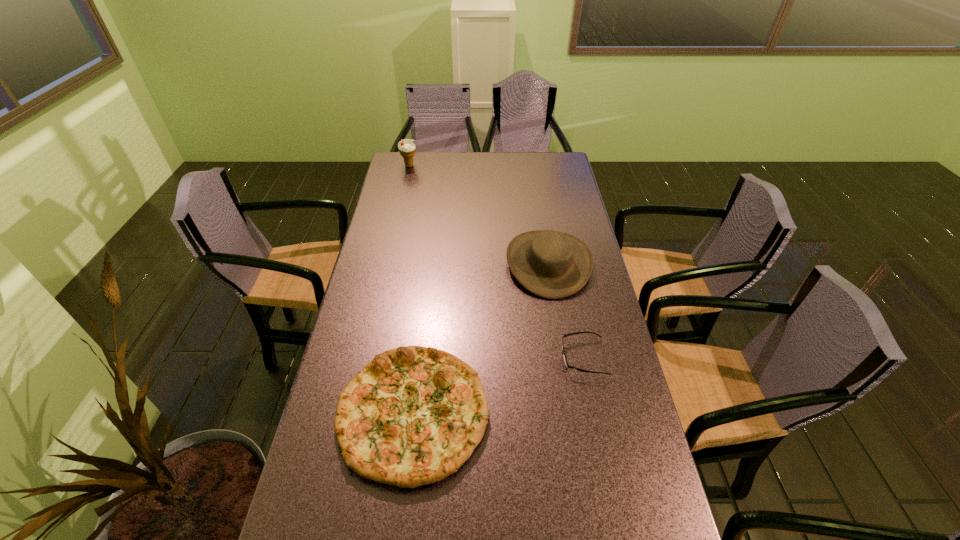
Identify the location of vacant space at the right edge. point(583,339).

In the image, there is a desktop. In order to click on vacant space at the far left corner in this screenshot , I will do `click(418, 173)`.

Identify the location of vacant space at the far right corner of the desktop. (570, 174).

The image size is (960, 540). I want to click on vacant space in between the cowboy hat and the icecream, so click(479, 214).

This screenshot has width=960, height=540. In order to click on vacant space that's between the tallest object and the cowboy hat in this screenshot , I will do `click(479, 214)`.

Where is `free point between the second shortest object and the icecream`? free point between the second shortest object and the icecream is located at coordinates (412, 289).

The height and width of the screenshot is (540, 960). I want to click on vacant space that is in between the sunglasses and the farthest object, so click(x=496, y=261).

The image size is (960, 540). I want to click on vacant point located between the second shortest object and the cowboy hat, so click(481, 338).

Identify the location of free area in between the second shortest object and the tallest object. The width and height of the screenshot is (960, 540). pyautogui.click(x=412, y=289).

At what (x,y) coordinates should I click in order to perform the action: click on free space between the second farthest object and the third tallest object. Please return your answer as a coordinate pair (x, y). This screenshot has height=540, width=960. Looking at the image, I should click on point(481,338).